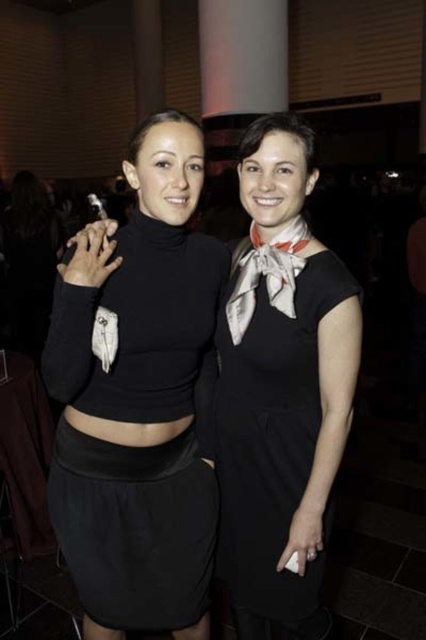
Who is shorter, black matte turtleneck at center or black satin dress at center?

black satin dress at center

What do you see at coordinates (137, 397) in the screenshot?
I see `black matte turtleneck at center` at bounding box center [137, 397].

Between point (140, 568) and point (259, 490), which one is positioned in front?

Positioned in front is point (140, 568).

Where is `black matte turtleneck at center`? The width and height of the screenshot is (426, 640). black matte turtleneck at center is located at coordinates (137, 397).